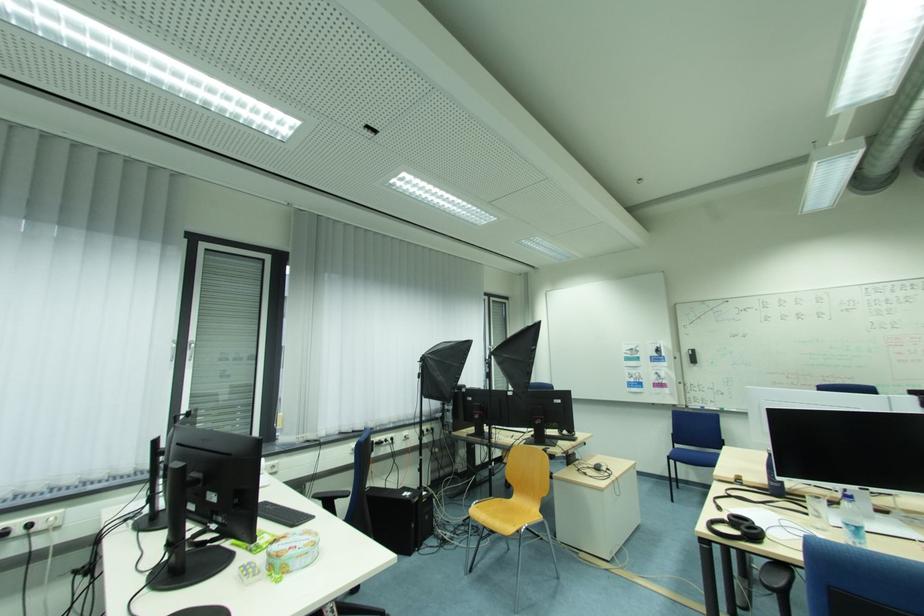
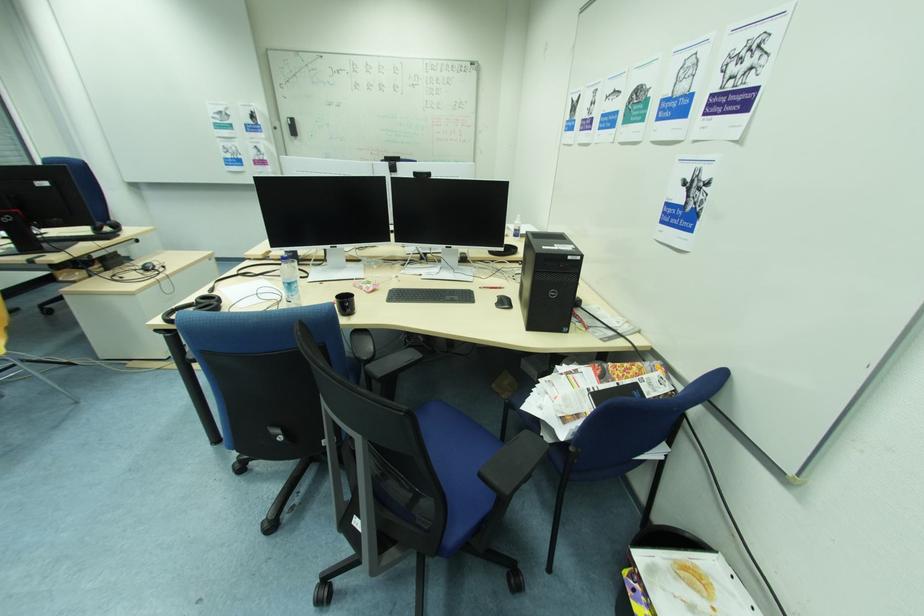
Where in the second image is the point corresponding to [687,353] from the first image?

(286, 122)